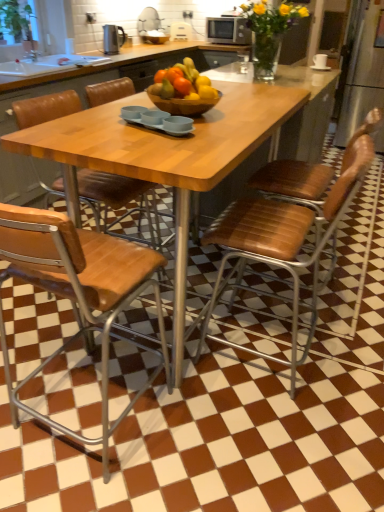
Where is `vacant area situated below wooden at center, arranged as the third chair when viewed from the right (from a real-world perspective)`? This screenshot has width=384, height=512. vacant area situated below wooden at center, arranged as the third chair when viewed from the right (from a real-world perspective) is located at coordinates (132, 428).